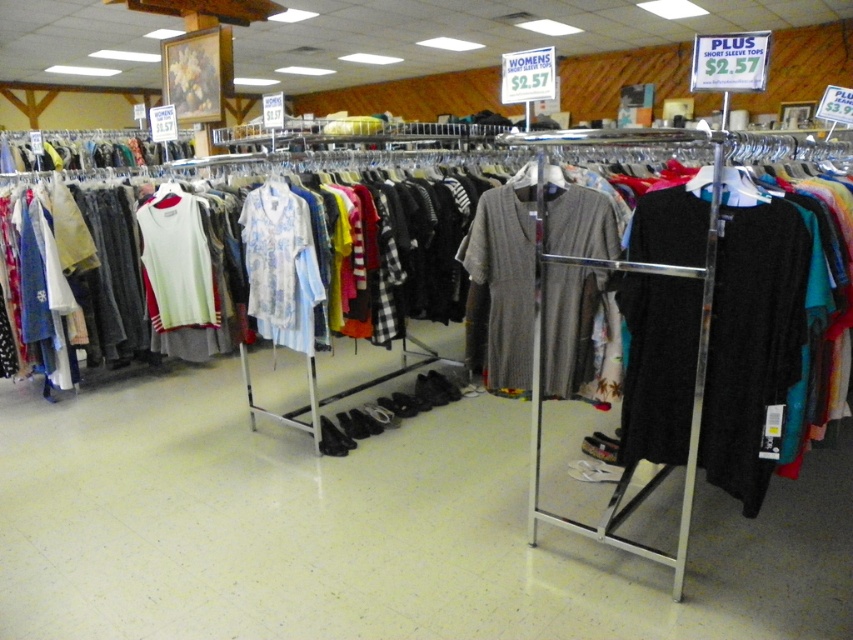
You are a customer in a thrift store looking at two items displayed on a rack. You see the knit gray dress at center and the light blue floral fabric shirt at center. Which item is located to the right of the other?

The knit gray dress at center is positioned on the right side of light blue floral fabric shirt at center, so the knit gray dress at center is to the right of the light blue floral fabric shirt at center.

You are a customer in a thrift store and you want to grab both the knit gray dress at center and the light blue floral fabric shirt at center. However, you can only reach items within 1 meter of each other. Can you reach both items at the same time?

The distance between the knit gray dress at center and the light blue floral fabric shirt at center is 87.45 centimeters, which is less than 1 meter. Therefore, you can reach both items at the same time.

You are a customer in a thrift store looking to buy a knit gray dress at center and a light blue floral fabric shirt at center. The store has a policy that if one item is larger than the other, you can only buy the smaller one. Which item should you choose?

The knit gray dress at center is larger in size than the light blue floral fabric shirt at center, so you should choose the light blue floral fabric shirt at center since it is the smaller item.